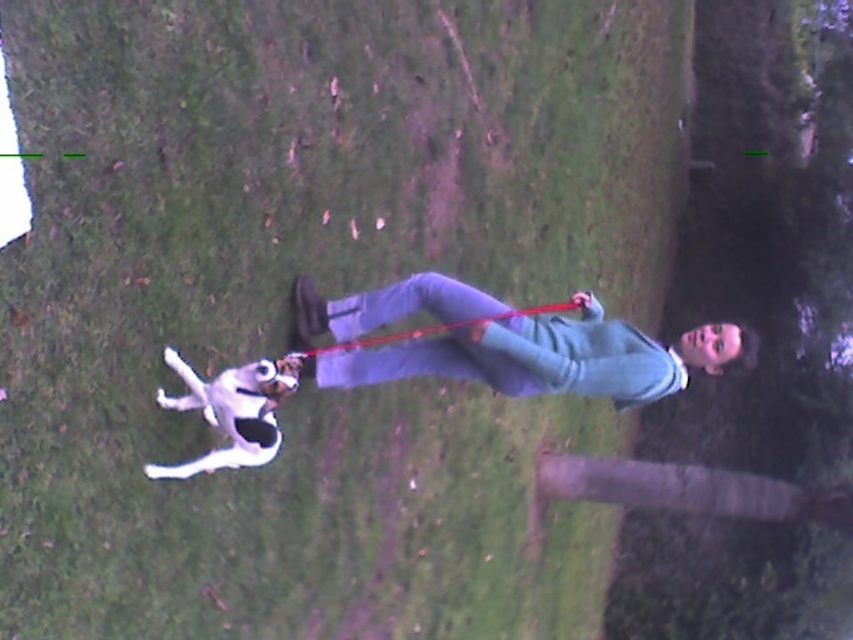
You are a fashion designer observing the person in the image. You need to determine which item of clothing is taller between the denim pants at center and the black fabric neckband at center. Which one is taller?

The denim pants at center has a greater height compared to the black fabric neckband at center, so the denim pants at center is taller.

You are a photographer trying to capture the person and their dog in the image. Since the denim pants at center and the black fabric neckband at center are both at the center, which one is positioned higher on the person?

The denim pants at center is above the black fabric neckband at center, so the denim pants at center is positioned higher on the person.